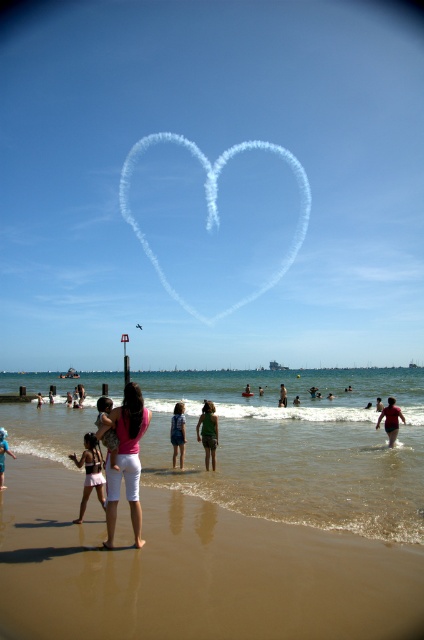
Is pink fabric at lower center wider than green fabric shirt at center?

Incorrect, pink fabric at lower center's width does not surpass green fabric shirt at center's.

Is the position of pink fabric at lower center less distant than that of green fabric shirt at center?

Yes, pink fabric at lower center is closer to the viewer.

Describe the element at coordinates (125, 460) in the screenshot. This screenshot has height=640, width=424. I see `pink fabric at lower center` at that location.

This screenshot has width=424, height=640. Find the location of `pink fabric at lower center`. pink fabric at lower center is located at coordinates (125, 460).

Is green fabric shirt at center thinner than pink fabric at center?

Correct, green fabric shirt at center's width is less than pink fabric at center's.

Is green fabric shirt at center shorter than pink fabric at center?

Indeed, green fabric shirt at center has a lesser height compared to pink fabric at center.

Is point (209, 420) closer to camera compared to point (398, 408)?

Yes.

Where is `green fabric shirt at center`? The height and width of the screenshot is (640, 424). green fabric shirt at center is located at coordinates (208, 433).

Does green fabric shirt at center appear on the right side of denim shorts at center?

Yes, green fabric shirt at center is to the right of denim shorts at center.

Does green fabric shirt at center have a smaller size compared to denim shorts at center?

Indeed, green fabric shirt at center has a smaller size compared to denim shorts at center.

Which is in front, point (214, 417) or point (175, 403)?

Point (214, 417)

The width and height of the screenshot is (424, 640). Identify the location of green fabric shirt at center. (208, 433).